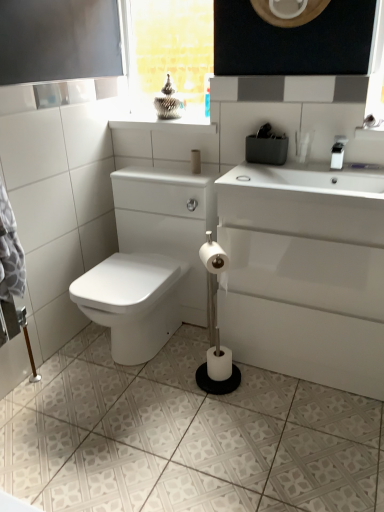
Identify the location of vacant area located to the right-hand side of white matte toilet paper at center, the 1th toilet paper in the bottom-to-top sequence. (257, 383).